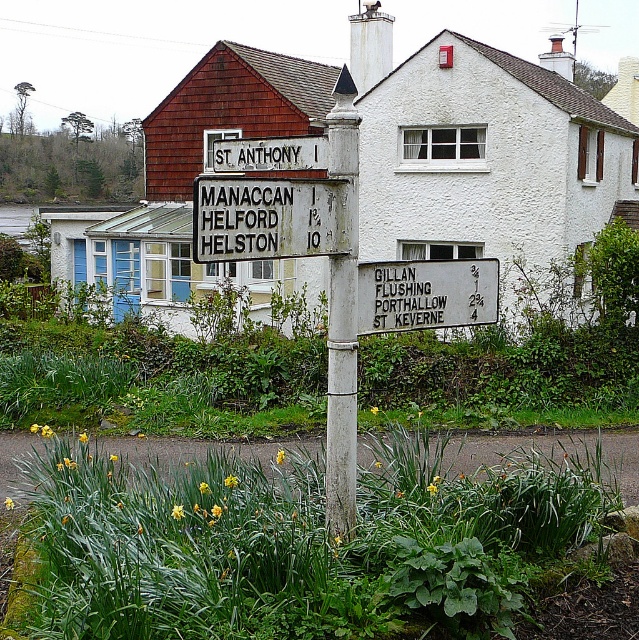
Question: Does white bamboo pole at center appear under white painted wood sign at upper center?

Choices:
 (A) yes
 (B) no

Answer: (A)

Question: Can you confirm if white bamboo pole at center is positioned above white painted wood sign at upper center?

Choices:
 (A) yes
 (B) no

Answer: (B)

Question: Estimate the real-world distances between objects in this image. Which object is closer to the weathered wood sign at center?

Choices:
 (A) white bamboo pole at center
 (B) white painted wood sign at upper center

Answer: (A)

Question: Can you confirm if white bamboo pole at center is smaller than white paper sign at center?

Choices:
 (A) no
 (B) yes

Answer: (B)

Question: Based on their relative distances, which object is farther from the white bamboo pole at center?

Choices:
 (A) weathered wood sign at center
 (B) white painted wood sign at upper center

Answer: (B)

Question: Which of these objects is positioned closest to the weathered wood sign at center?

Choices:
 (A) white bamboo pole at center
 (B) white painted wood sign at upper center

Answer: (A)